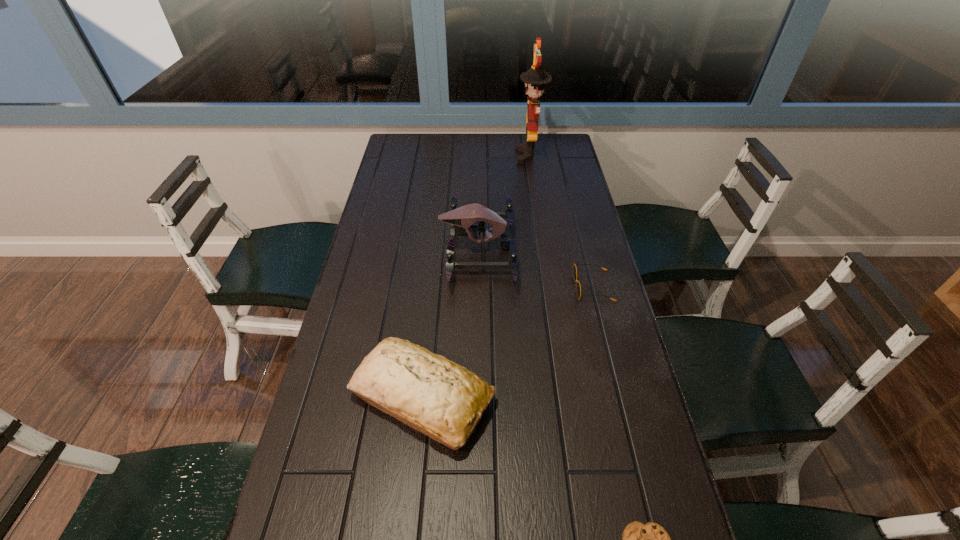
At what (x,y) coordinates should I click in order to perform the action: click on the farthest object. Please return your answer as a coordinate pair (x, y). The image size is (960, 540). Looking at the image, I should click on (535, 78).

Where is `the third object from left to right`? This screenshot has width=960, height=540. the third object from left to right is located at coordinates (535, 78).

Find the location of a particular element. drone is located at coordinates (463, 218).

At what (x,y) coordinates should I click in order to perform the action: click on the third shortest object. Please return your answer as a coordinate pair (x, y). Image resolution: width=960 pixels, height=540 pixels. Looking at the image, I should click on (445, 401).

Where is `bread`? The width and height of the screenshot is (960, 540). bread is located at coordinates (445, 401).

At what (x,y) coordinates should I click in order to perform the action: click on sunglasses. Please return your answer as a coordinate pair (x, y). Looking at the image, I should click on (578, 287).

Where is `free point located 0.210m on the front-facing side of the third object from left to right`? The width and height of the screenshot is (960, 540). free point located 0.210m on the front-facing side of the third object from left to right is located at coordinates (464, 156).

Where is `vacant space located 0.130m on the front-facing side of the third object from left to right`? The image size is (960, 540). vacant space located 0.130m on the front-facing side of the third object from left to right is located at coordinates (484, 156).

You are a GUI agent. You are given a task and a screenshot of the screen. Output one action in this format:
    pyautogui.click(x=<x>, y=<y>)
    Task: Click on the free space located 0.190m on the front-facing side of the third object from left to right
    Image resolution: width=960 pixels, height=540 pixels.
    Given the screenshot: What is the action you would take?
    pyautogui.click(x=469, y=156)

Where is `free location located on the front-facing side of the drone`? The width and height of the screenshot is (960, 540). free location located on the front-facing side of the drone is located at coordinates (538, 248).